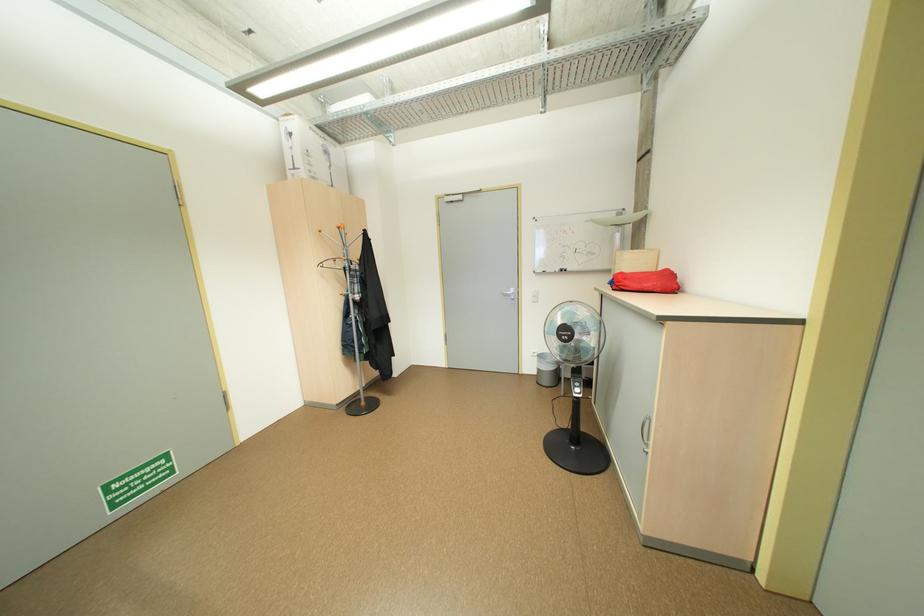
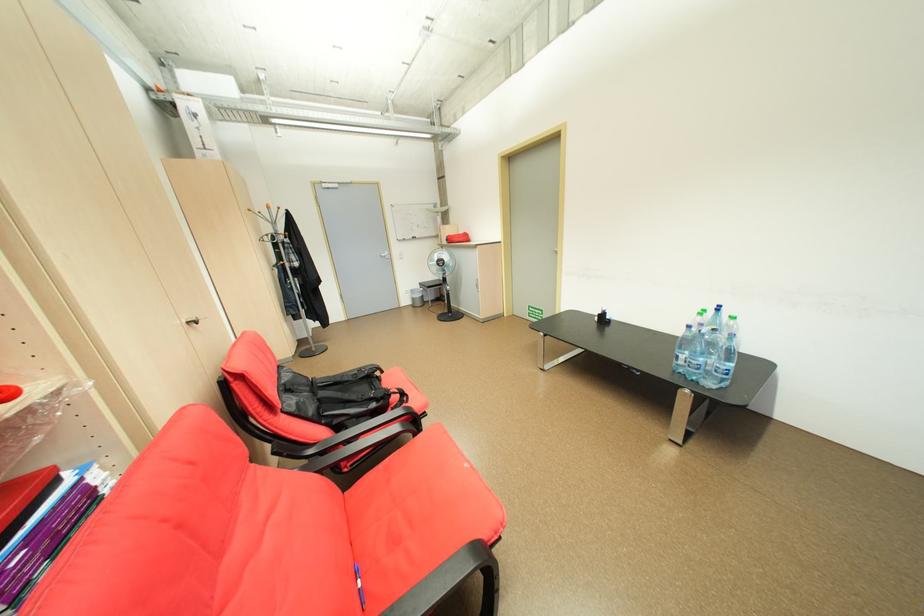
Where in the second image is the point corresponding to [539,368] from the first image?

(415, 302)